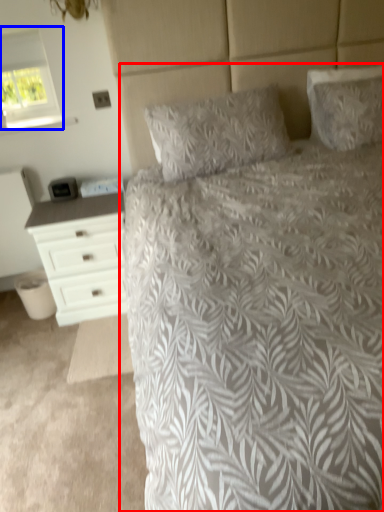
Question: Which object is closer to the camera taking this photo, bed (highlighted by a red box) or window (highlighted by a blue box)?

Choices:
 (A) bed
 (B) window

Answer: (A)